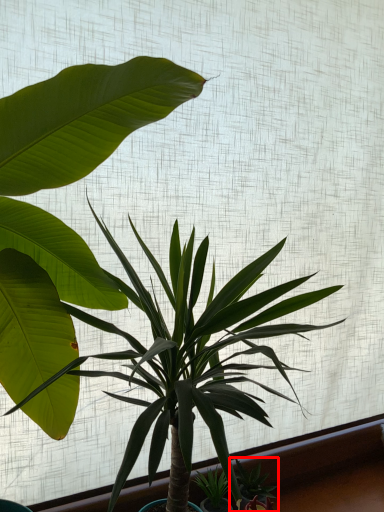
Question: Observing the image, what is the correct spatial positioning of houseplant (annotated by the red box) in reference to houseplant?

Choices:
 (A) left
 (B) right

Answer: (B)